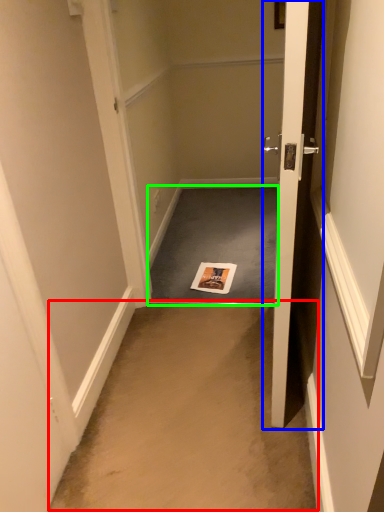
Question: Considering the real-world distances, which object is closest to corridor (highlighted by a red box)? door (highlighted by a blue box) or doormat (highlighted by a green box).

Choices:
 (A) door
 (B) doormat

Answer: (A)